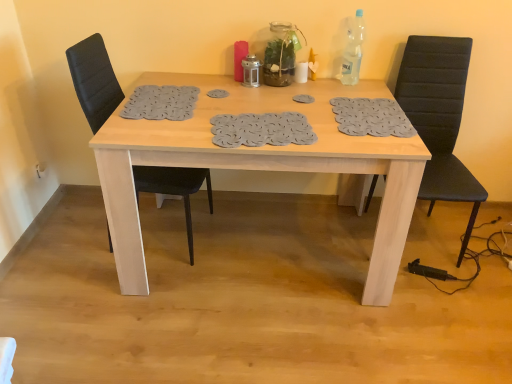
Question: Does point tap(105, 87) appear closer or farther from the camera than point tap(420, 52)?

Choices:
 (A) farther
 (B) closer

Answer: (B)

Question: Is black leather chair at left, positioned as the 1th chair in left-to-right order, wider or thinner than black leather chair at right, which is counted as the first chair, starting from the right?

Choices:
 (A) wide
 (B) thin

Answer: (B)

Question: Based on their relative distances, which object is farther from the black leather chair at right, arranged as the 2th chair when viewed from the left?

Choices:
 (A) light wood table at center
 (B) black leather chair at left, positioned as the 1th chair in left-to-right order

Answer: (B)

Question: Which object is positioned closest to the black leather chair at left, the second chair from the right?

Choices:
 (A) light wood table at center
 (B) black leather chair at right, which is counted as the first chair, starting from the right

Answer: (A)